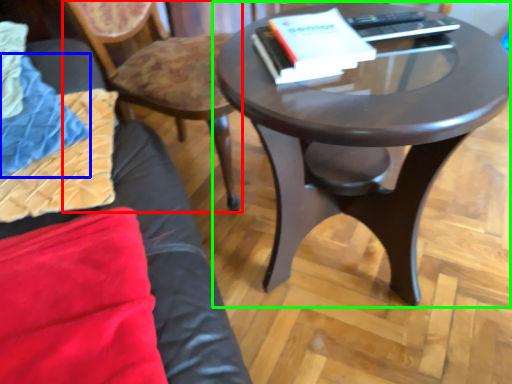
Question: Considering the real-world distances, which object is farthest from chair (highlighted by a red box)? blanket (highlighted by a blue box) or coffee table (highlighted by a green box)?

Choices:
 (A) blanket
 (B) coffee table

Answer: (B)